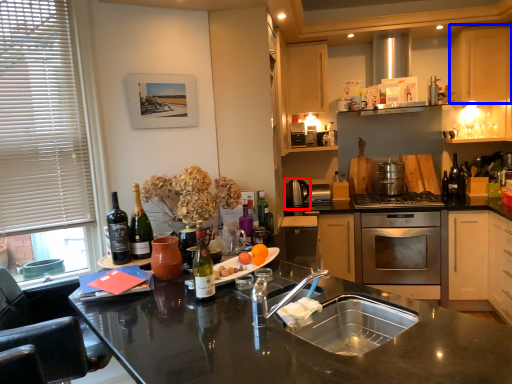
Question: Among these objects, which one is farthest to the camera, appliance (highlighted by a red box) or cabinetry (highlighted by a blue box)?

Choices:
 (A) appliance
 (B) cabinetry

Answer: (A)